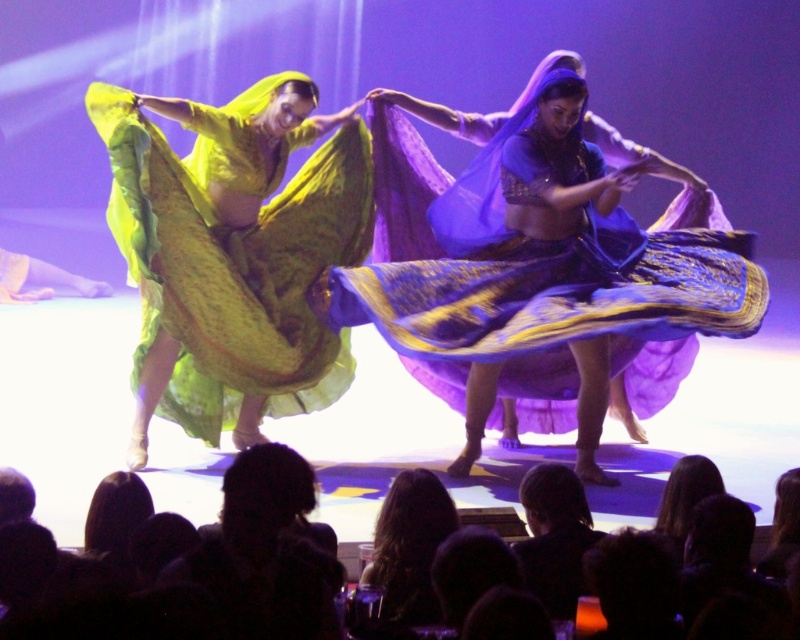
Question: Which point is farther to the camera?

Choices:
 (A) (642, 259)
 (B) (532, 556)

Answer: (A)

Question: Which of these objects is positioned closest to the matte green fabric at left?

Choices:
 (A) matte purple fabric at center
 (B) dark fabric headscarf at lower center

Answer: (A)

Question: Does matte purple fabric at center have a greater width compared to matte green fabric at left?

Choices:
 (A) no
 (B) yes

Answer: (B)

Question: Is matte purple fabric at center closer to camera compared to dark fabric headscarf at lower center?

Choices:
 (A) yes
 (B) no

Answer: (B)

Question: Is matte purple fabric at center above dark fabric headscarf at lower center?

Choices:
 (A) yes
 (B) no

Answer: (A)

Question: Estimate the real-world distances between objects in this image. Which object is farther from the dark fabric headscarf at lower center?

Choices:
 (A) matte purple fabric at center
 (B) matte green fabric at left

Answer: (B)